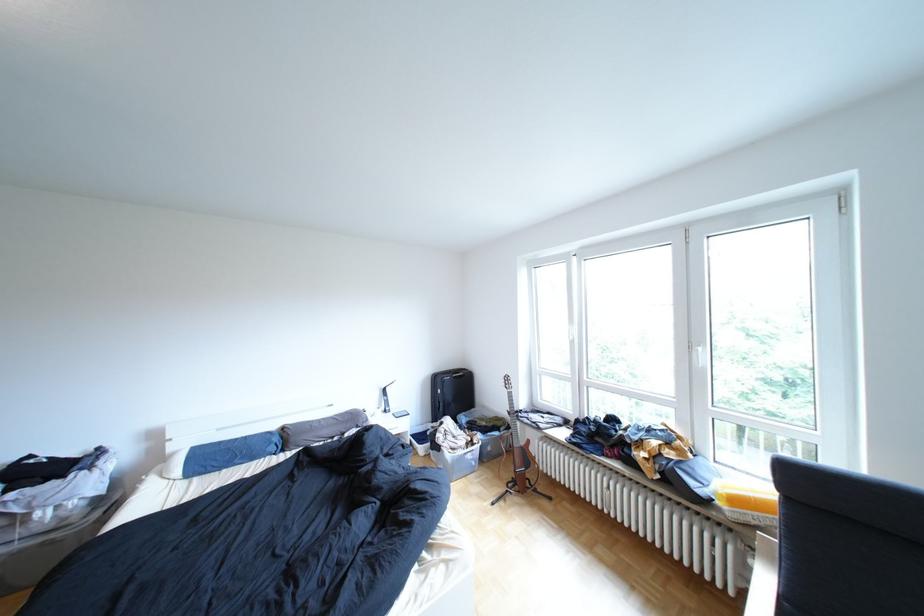
This screenshot has width=924, height=616. In order to click on suitcase handle in this screenshot , I will do `click(456, 383)`.